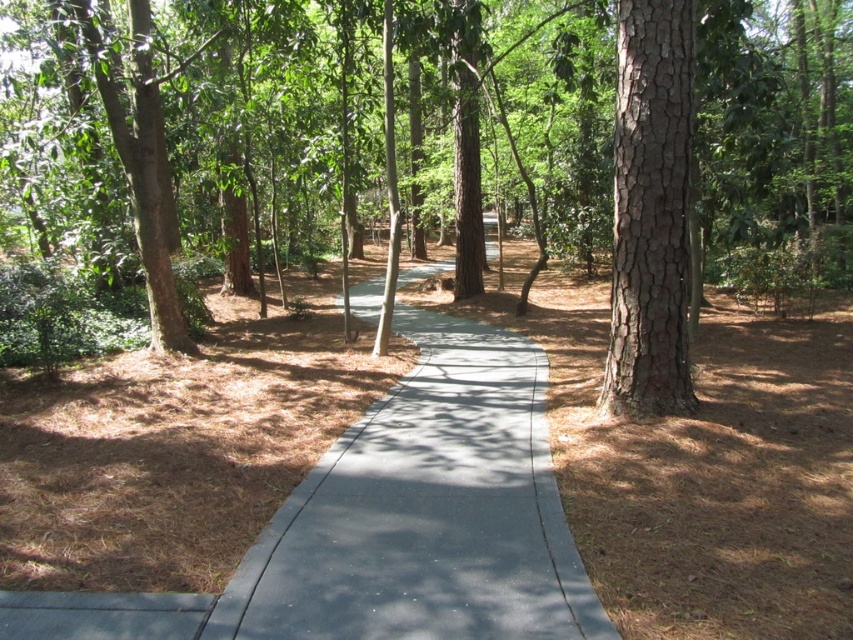
Can you confirm if brown rough tree trunk at center is positioned to the left of brown rough bark tree at right?

Indeed, brown rough tree trunk at center is positioned on the left side of brown rough bark tree at right.

Is brown rough tree trunk at center positioned behind brown rough bark tree at right?

Yes, brown rough tree trunk at center is behind brown rough bark tree at right.

Locate an element on the screen. The height and width of the screenshot is (640, 853). brown rough tree trunk at center is located at coordinates (772, 118).

In order to click on brown rough tree trunk at center in this screenshot , I will do `click(772, 118)`.

Who is lower down, gray concrete trail at center or brown rough bark tree at right?

gray concrete trail at center is lower down.

The width and height of the screenshot is (853, 640). Find the location of `gray concrete trail at center`. gray concrete trail at center is located at coordinates [425, 513].

Is point (316, 602) more distant than point (642, 388)?

That is False.

The image size is (853, 640). What are the coordinates of `gray concrete trail at center` in the screenshot? It's located at (425, 513).

Can you confirm if brown rough tree trunk at center is positioned to the left of gray concrete trail at center?

In fact, brown rough tree trunk at center is to the right of gray concrete trail at center.

Who is positioned more to the left, brown rough tree trunk at center or gray concrete trail at center?

gray concrete trail at center

Between point (639, 157) and point (351, 611), which one is positioned in front?

Point (351, 611) is in front.

The width and height of the screenshot is (853, 640). In order to click on brown rough tree trunk at center in this screenshot , I will do `click(772, 118)`.